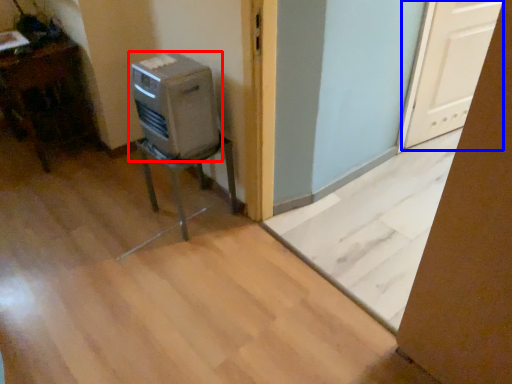
Question: Which of the following is the closest to the observer, home appliance (highlighted by a red box) or screen door (highlighted by a blue box)?

Choices:
 (A) home appliance
 (B) screen door

Answer: (A)